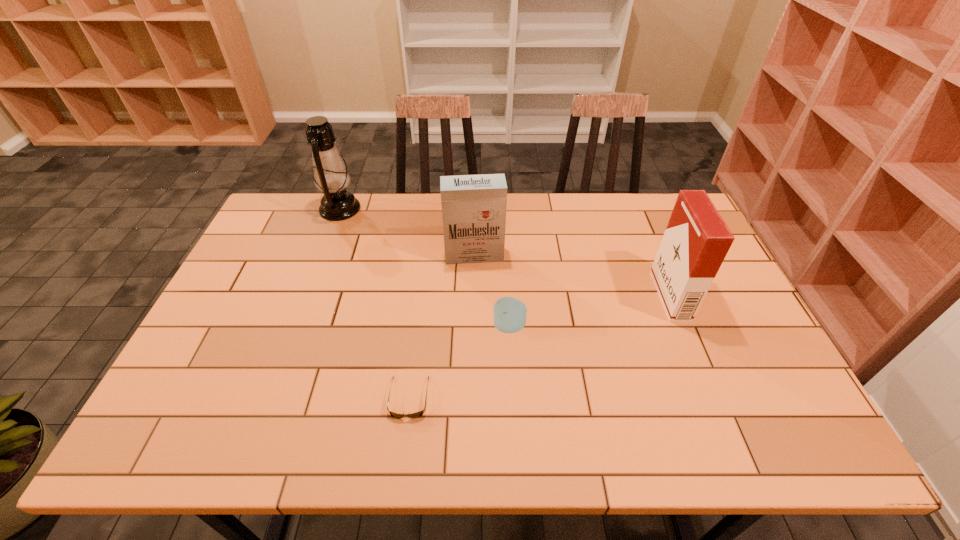
At what (x,y) coordinates should I click in order to perform the action: click on oil lamp. Please return your answer as a coordinate pair (x, y). Looking at the image, I should click on (330, 174).

Where is `the leftmost object`? The width and height of the screenshot is (960, 540). the leftmost object is located at coordinates (330, 174).

The width and height of the screenshot is (960, 540). Identify the location of the rightmost object. (696, 241).

In order to click on the right cigarette case in this screenshot , I will do `click(696, 241)`.

You are a GUI agent. You are given a task and a screenshot of the screen. Output one action in this format:
    pyautogui.click(x=<x>, y=<y>)
    Task: Click on the second farthest object
    The width and height of the screenshot is (960, 540).
    Given the screenshot: What is the action you would take?
    pyautogui.click(x=473, y=206)

Identify the location of the left cigarette case. (473, 206).

I want to click on the second shortest object, so click(x=509, y=315).

This screenshot has width=960, height=540. Find the location of `sunglasses`. sunglasses is located at coordinates (418, 414).

This screenshot has width=960, height=540. What are the coordinates of `the nearest object` in the screenshot? It's located at [x=418, y=414].

Where is `free spot located on the front of the leftmost object`? The width and height of the screenshot is (960, 540). free spot located on the front of the leftmost object is located at coordinates (324, 249).